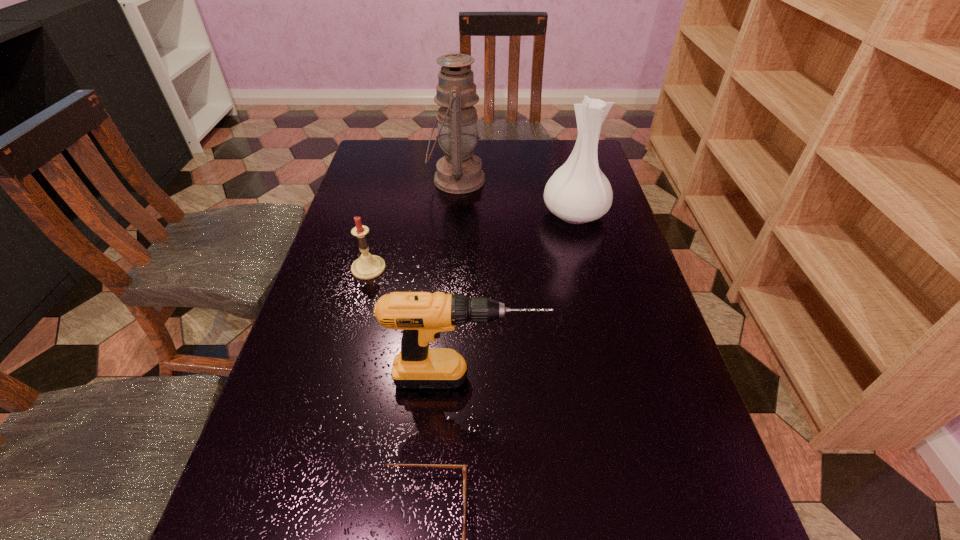
Identify the location of vacant area that lies between the vase and the second shortest object. Image resolution: width=960 pixels, height=540 pixels. (471, 241).

The width and height of the screenshot is (960, 540). Identify the location of free space between the oil lamp and the drill. (462, 279).

What are the coordinates of `the fourth closest object to the tallest object` in the screenshot? It's located at (464, 467).

Locate an element on the screen. object identified as the fourth closest to the drill is located at coordinates (459, 171).

Where is `vacant space that satisfies the following two spatial constraints: 1. on the back side of the candle; 2. on the left side of the oil lamp`? Image resolution: width=960 pixels, height=540 pixels. vacant space that satisfies the following two spatial constraints: 1. on the back side of the candle; 2. on the left side of the oil lamp is located at coordinates 393,180.

At what (x,y) coordinates should I click in order to perform the action: click on vacant position in the image that satisfies the following two spatial constraints: 1. on the back side of the oil lamp; 2. on the left side of the leftmost object. Please return your answer as a coordinate pair (x, y). The width and height of the screenshot is (960, 540). Looking at the image, I should click on (393, 180).